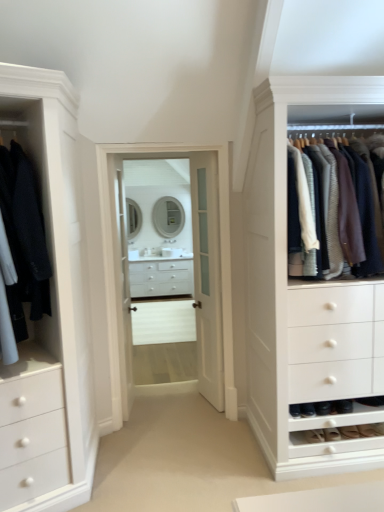
Question: In terms of width, does white glossy drawer at center look wider or thinner when compared to white glass door at center?

Choices:
 (A) wide
 (B) thin

Answer: (A)

Question: Is white glossy drawer at center spatially inside white glass door at center, or outside of it?

Choices:
 (A) inside
 (B) outside

Answer: (B)

Question: Which object is positioned farthest from the matte black coat at left, positioned as the 1th clothing in left-to-right order?

Choices:
 (A) suede shoe at lower right, positioned as the 2th shoe in right-to-left order
 (B) clear glass door at center, the first glass door from the left
 (C) white glass door at center
 (D) white glossy drawer at center
 (E) knit sweater at right, which appears as the 1th clothing when viewed from the right

Answer: (D)

Question: Based on their relative distances, which object is nearer to the clear glass door at center, the second glass door viewed from the right?

Choices:
 (A) clear glass door at center, which is the 1th glass door in right-to-left order
 (B) matte silver mirror at center, which ranks as the 1th mirror in left-to-right order
 (C) white glass door at center
 (D) matte black coat at left, which ranks as the 2th clothing in right-to-left order
 (E) white glass mirror at center, the 1th mirror when ordered from right to left

Answer: (A)